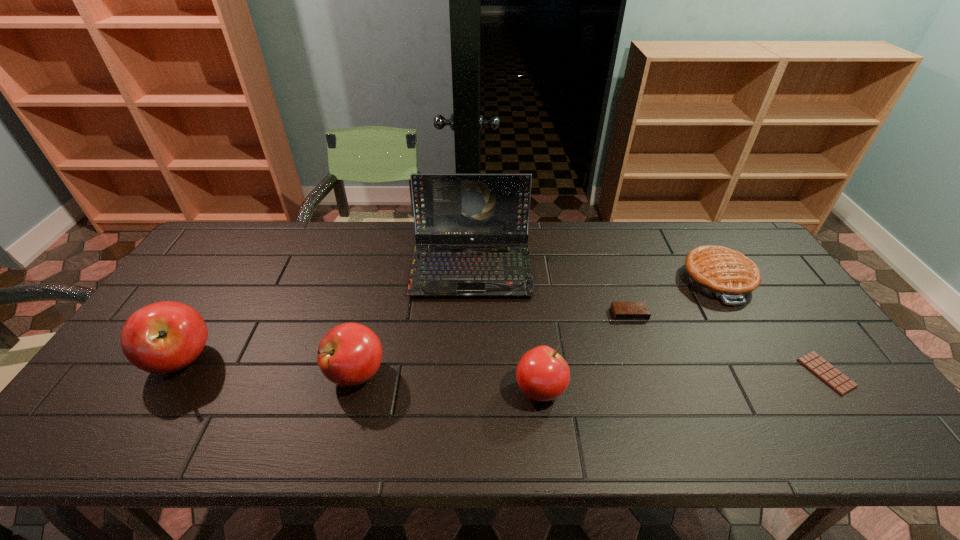
You are a GUI agent. You are given a task and a screenshot of the screen. Output one action in this format:
    pyautogui.click(x=<x>, y=<y>)
    Task: Click on the free space that satisfies the following two spatial constraints: 1. on the front face of the candy bar; 2. on the right side of the sixth tallest object
    The image size is (960, 540).
    Given the screenshot: What is the action you would take?
    pyautogui.click(x=650, y=373)

Locate an element on the screen. Image resolution: width=960 pixels, height=540 pixels. free space that satisfies the following two spatial constraints: 1. on the back side of the fourth shortest object; 2. on the right side of the candy bar is located at coordinates (539, 373).

This screenshot has width=960, height=540. I want to click on free location that satisfies the following two spatial constraints: 1. on the screen of the tallest object; 2. on the left side of the rightmost apple, so click(x=468, y=389).

Where is `vacant position in the image that satisfies the following two spatial constraints: 1. on the front face of the fifth object from left to right; 2. on the right side of the candy bar`? vacant position in the image that satisfies the following two spatial constraints: 1. on the front face of the fifth object from left to right; 2. on the right side of the candy bar is located at coordinates (650, 373).

Identify the location of free region that satisfies the following two spatial constraints: 1. on the back side of the second apple from left to right; 2. on the left side of the candy bar. This screenshot has width=960, height=540. (356, 373).